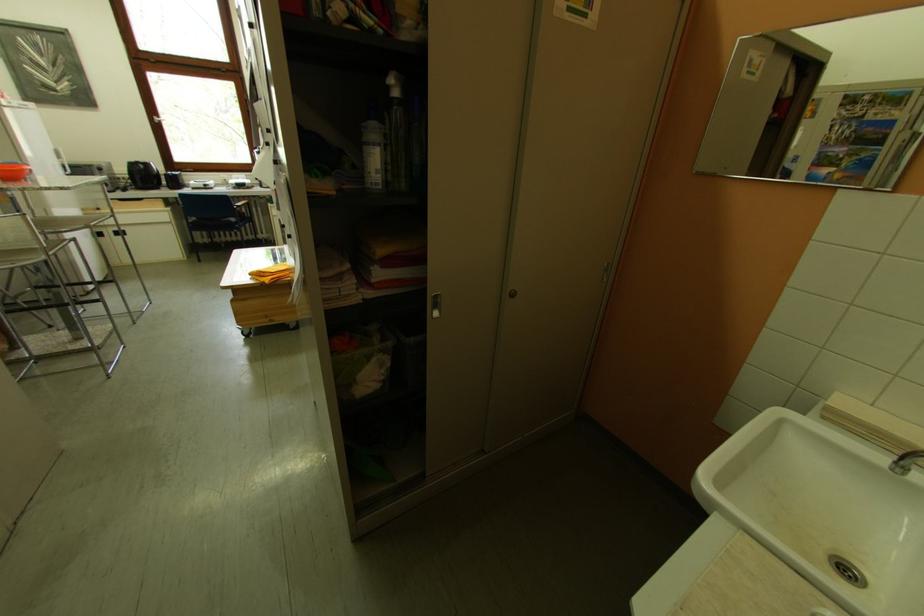
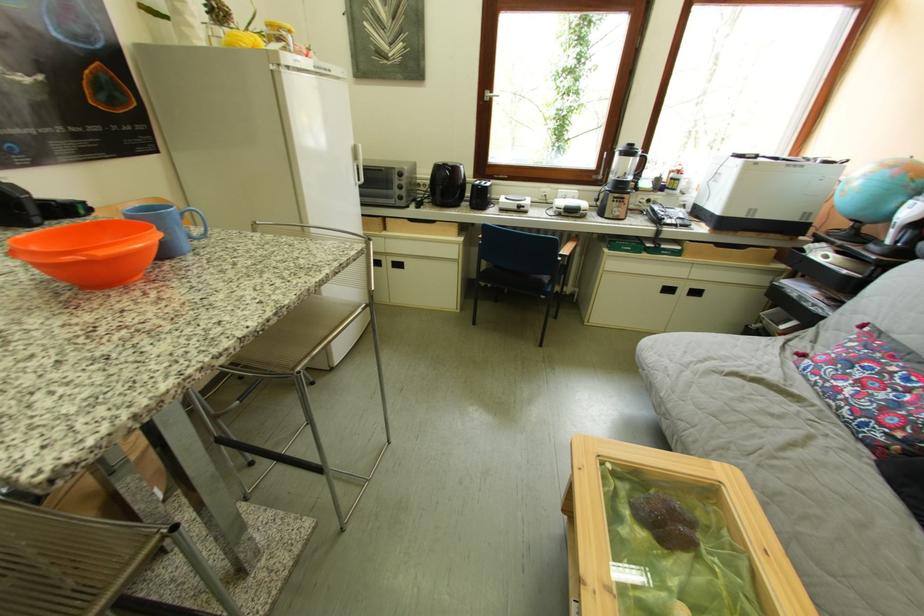
Locate, in the second image, the point that corresponds to [146,168] in the first image.

(451, 171)